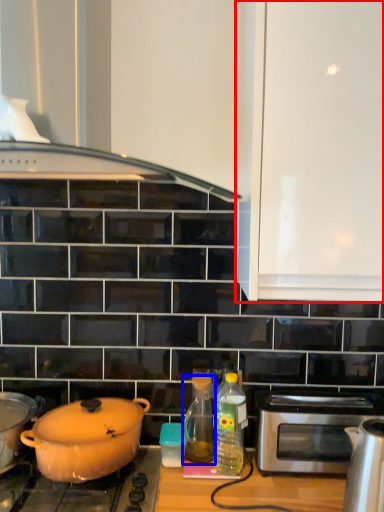
Question: Which object is further to the camera taking this photo, cabinetry (highlighted by a red box) or bottle (highlighted by a blue box)?

Choices:
 (A) cabinetry
 (B) bottle

Answer: (B)